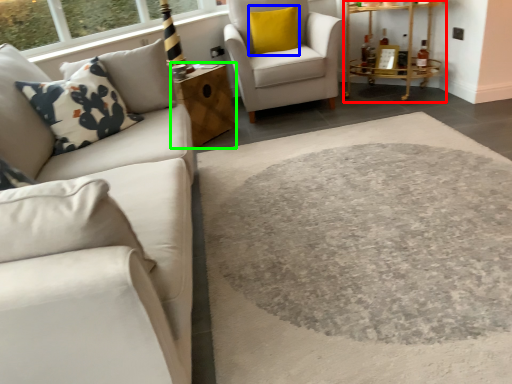
Question: Estimate the real-world distances between objects in this image. Which object is closer to table (highlighted by a red box), pillow (highlighted by a blue box) or table (highlighted by a green box)?

Choices:
 (A) pillow
 (B) table

Answer: (A)